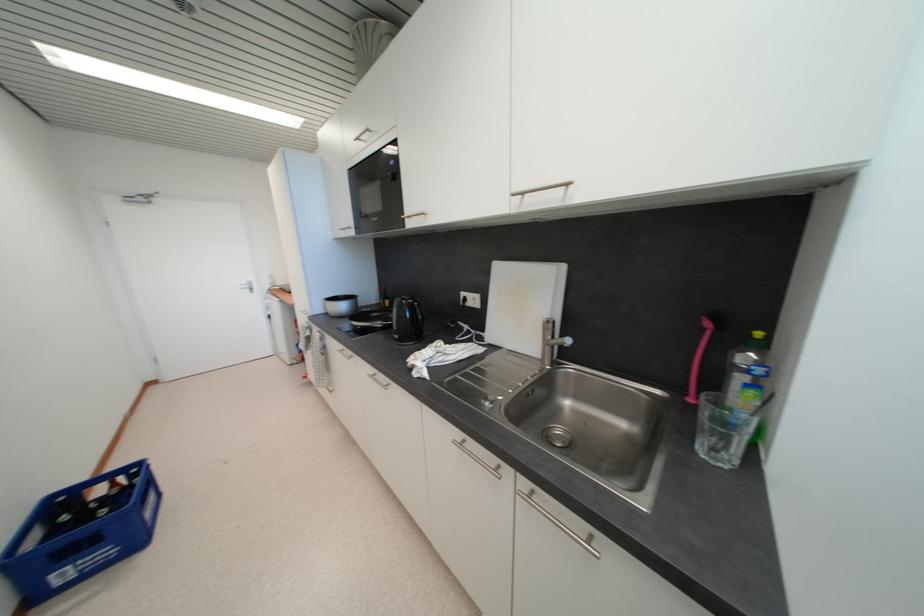
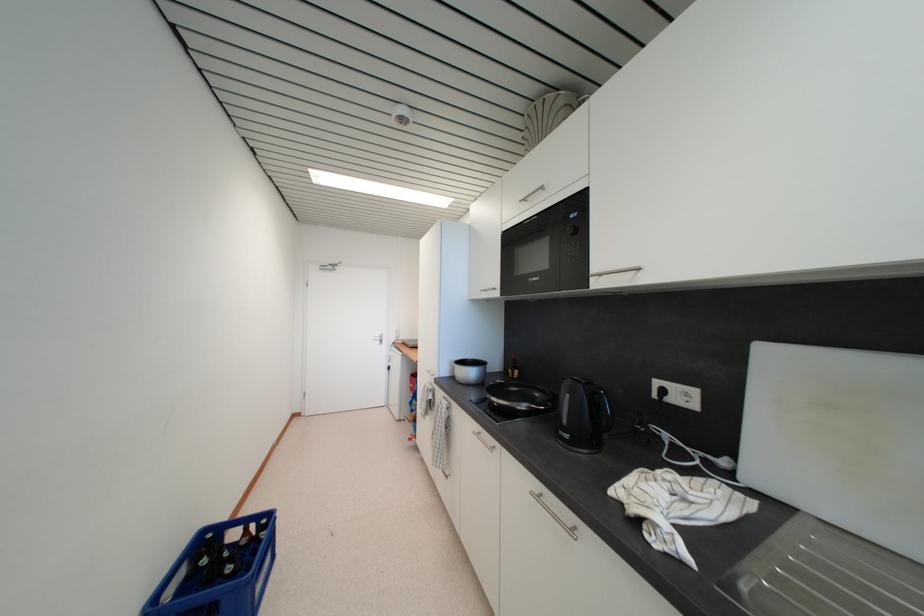
What movement of the cameraman would produce the second image?

The movement direction of the cameraman is left, forward.